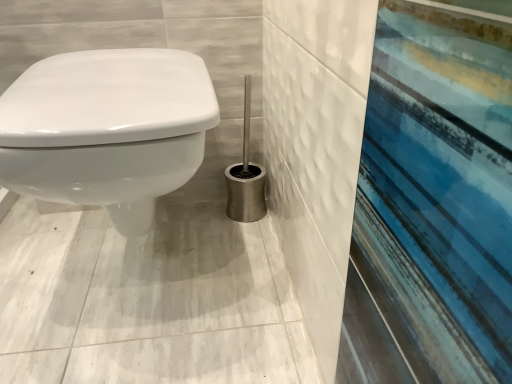
This screenshot has width=512, height=384. I want to click on vacant space underneath white glossy toilet at left (from a real-world perspective), so click(140, 276).